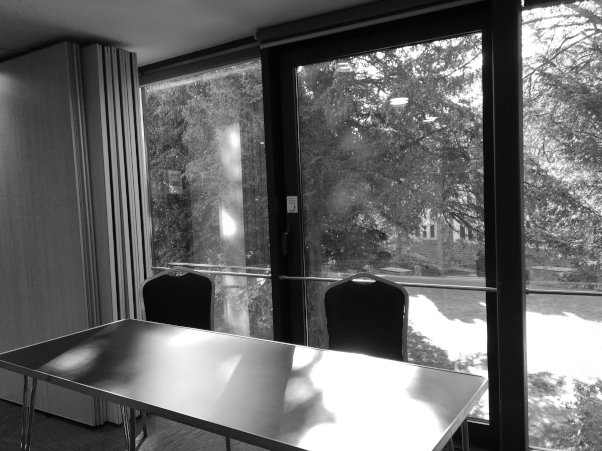
Find the location of a particular element. The height and width of the screenshot is (451, 602). center top window glass is located at coordinates (396, 156).